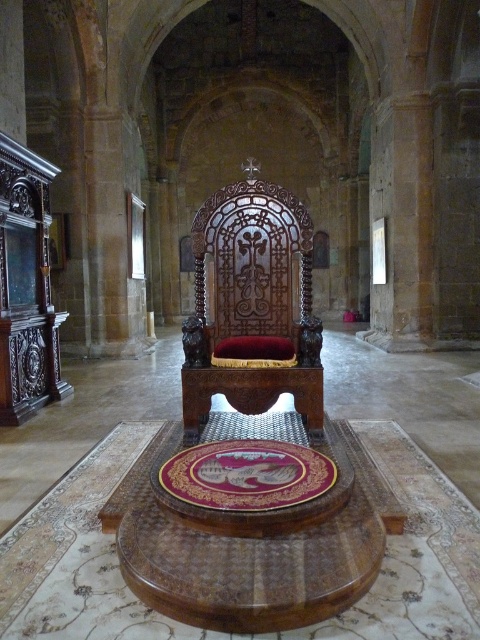
In the scene shown: You are standing in the grand cathedral and want to approach the throne. Based on the image, what are the coordinates of the polished wood throne at center?

The coordinates of the polished wood throne at center are at point (252,307).

You are standing in the grand cathedral and notice the polished wood round table at center. Can you determine its exact position relative to the throne?

The polished wood round table at center is located at point coordinates of 0.889 along the x axis and 0.523 along the y axis.